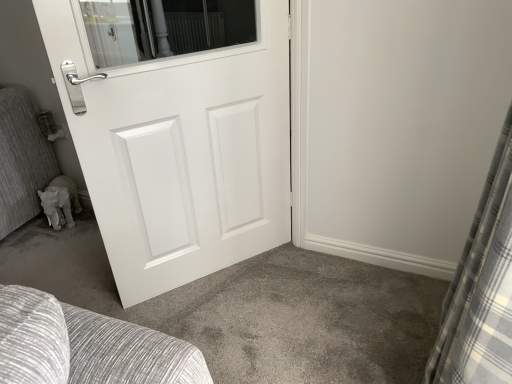
Question: Can you confirm if white matte door at center is positioned to the right of gray plaid curtain at right?

Choices:
 (A) yes
 (B) no

Answer: (B)

Question: Can you confirm if white matte door at center is positioned to the left of gray plaid curtain at right?

Choices:
 (A) no
 (B) yes

Answer: (B)

Question: Could you tell me if white matte door at center is turned towards gray plaid curtain at right?

Choices:
 (A) yes
 (B) no

Answer: (B)

Question: Is white matte door at center bigger than gray plaid curtain at right?

Choices:
 (A) yes
 (B) no

Answer: (B)

Question: Is gray plaid curtain at right at the back of white matte door at center?

Choices:
 (A) yes
 (B) no

Answer: (A)

Question: Does white matte door at center have a lesser width compared to gray plaid curtain at right?

Choices:
 (A) yes
 (B) no

Answer: (A)

Question: From a real-world perspective, is gray plaid curtain at right located higher than white matte door at center?

Choices:
 (A) yes
 (B) no

Answer: (A)

Question: Are gray plaid curtain at right and white matte door at center beside each other?

Choices:
 (A) no
 (B) yes

Answer: (A)

Question: From the image's perspective, is gray plaid curtain at right located beneath white matte door at center?

Choices:
 (A) no
 (B) yes

Answer: (B)

Question: Is gray plaid curtain at right oriented away from white matte door at center?

Choices:
 (A) yes
 (B) no

Answer: (B)

Question: Can you confirm if gray plaid curtain at right is bigger than white matte door at center?

Choices:
 (A) yes
 (B) no

Answer: (A)

Question: Does gray plaid curtain at right appear on the right side of white matte door at center?

Choices:
 (A) yes
 (B) no

Answer: (A)

Question: Considering the positions of gray plaid curtain at right and white matte door at center in the image, is gray plaid curtain at right taller or shorter than white matte door at center?

Choices:
 (A) tall
 (B) short

Answer: (A)